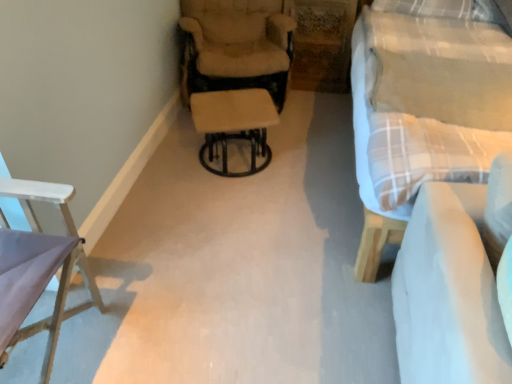
Question: Is beige fabric chair at center, arranged as the 1th chair when viewed from the top, bigger than white fabric couch at lower right?

Choices:
 (A) no
 (B) yes

Answer: (B)

Question: Is white fabric couch at lower right a part of beige fabric chair at center, the first chair from the right?

Choices:
 (A) no
 (B) yes

Answer: (A)

Question: Can you confirm if beige fabric chair at center, the 1th chair positioned from the back, is taller than white fabric couch at lower right?

Choices:
 (A) no
 (B) yes

Answer: (B)

Question: From the image's perspective, does beige fabric chair at center, the first chair from the right, appear higher than white fabric couch at lower right?

Choices:
 (A) yes
 (B) no

Answer: (A)

Question: Is beige fabric chair at center, the first chair from the right, far away from white fabric couch at lower right?

Choices:
 (A) yes
 (B) no

Answer: (A)

Question: Is point (273, 29) closer or farther from the camera than point (7, 193)?

Choices:
 (A) farther
 (B) closer

Answer: (A)

Question: In the image, is beige fabric chair at center, the 1th chair positioned from the back, positioned in front of or behind white wood chair at left, positioned as the first chair in left-to-right order?

Choices:
 (A) front
 (B) behind

Answer: (B)

Question: Is beige fabric chair at center, the second chair viewed from the left, bigger or smaller than white wood chair at left, positioned as the first chair in left-to-right order?

Choices:
 (A) big
 (B) small

Answer: (A)

Question: From a real-world perspective, relative to white wood chair at left, the 1th chair ordered from the bottom, is beige fabric chair at center, arranged as the 1th chair when viewed from the top, vertically above or below?

Choices:
 (A) below
 (B) above

Answer: (A)

Question: Is point (461, 350) closer or farther from the camera than point (73, 193)?

Choices:
 (A) closer
 (B) farther

Answer: (A)

Question: From the image's perspective, is white fabric couch at lower right above or below white wood chair at left, which appears as the second chair when viewed from the top?

Choices:
 (A) below
 (B) above

Answer: (A)

Question: Is white fabric couch at lower right to the left or to the right of white wood chair at left, positioned as the first chair in left-to-right order, in the image?

Choices:
 (A) right
 (B) left

Answer: (A)

Question: From a real-world perspective, is white fabric couch at lower right positioned above or below white wood chair at left, which appears as the second chair when viewed from the top?

Choices:
 (A) above
 (B) below

Answer: (A)

Question: Does point (471, 3) appear closer or farther from the camera than point (425, 269)?

Choices:
 (A) closer
 (B) farther

Answer: (B)

Question: From their relative heights in the image, would you say plaid fabric studio couch at right is taller or shorter than white fabric couch at lower right?

Choices:
 (A) tall
 (B) short

Answer: (A)